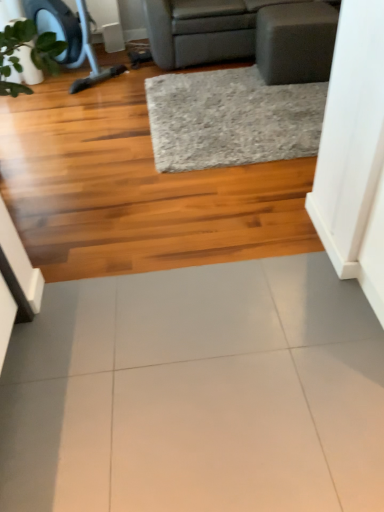
Question: Is white glossy tile at center closer to camera compared to gray textured rug at center?

Choices:
 (A) no
 (B) yes

Answer: (B)

Question: Does white glossy tile at center have a larger size compared to gray textured rug at center?

Choices:
 (A) yes
 (B) no

Answer: (B)

Question: Is white glossy tile at center shorter than gray textured rug at center?

Choices:
 (A) no
 (B) yes

Answer: (B)

Question: Would you consider white glossy tile at center to be distant from gray textured rug at center?

Choices:
 (A) no
 (B) yes

Answer: (B)

Question: Does white glossy tile at center contain gray textured rug at center?

Choices:
 (A) yes
 (B) no

Answer: (B)

Question: Does white glossy tile at center have a lesser width compared to gray textured rug at center?

Choices:
 (A) yes
 (B) no

Answer: (A)

Question: Is gray textured rug at center further to camera compared to white glossy tile at center?

Choices:
 (A) no
 (B) yes

Answer: (B)

Question: Does gray textured rug at center lie in front of white glossy tile at center?

Choices:
 (A) no
 (B) yes

Answer: (A)

Question: Is gray textured rug at center completely or partially outside of white glossy tile at center?

Choices:
 (A) yes
 (B) no

Answer: (A)

Question: Does gray textured rug at center have a larger size compared to white glossy tile at center?

Choices:
 (A) no
 (B) yes

Answer: (B)

Question: Is gray textured rug at center thinner than white glossy tile at center?

Choices:
 (A) no
 (B) yes

Answer: (A)

Question: Could you tell me if gray textured rug at center is facing white glossy tile at center?

Choices:
 (A) yes
 (B) no

Answer: (A)

Question: Considering the relative sizes of gray fabric studio couch at upper center and gray textured rug at center in the image provided, is gray fabric studio couch at upper center smaller than gray textured rug at center?

Choices:
 (A) no
 (B) yes

Answer: (A)